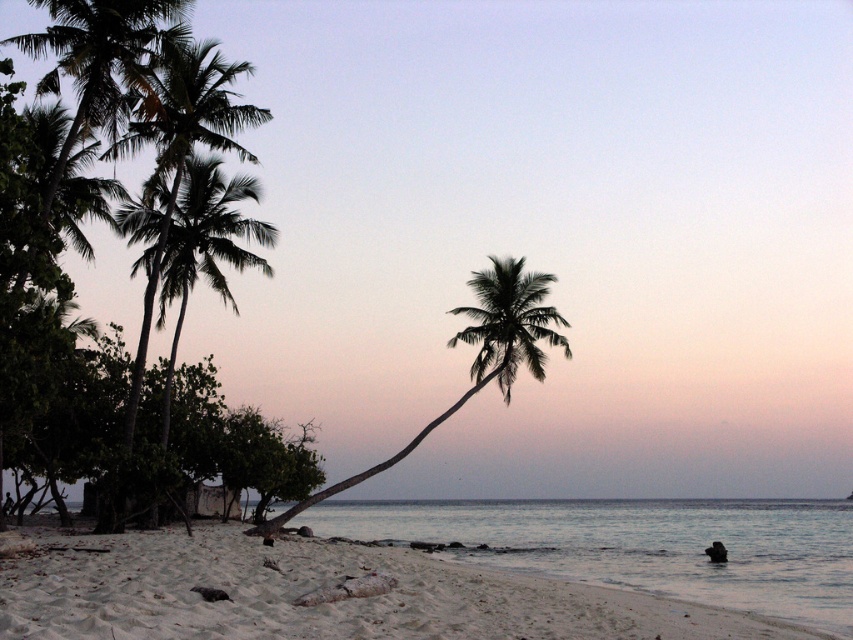
Question: Does white sandy beach at lower left come in front of green leafy palm tree at left?

Choices:
 (A) no
 (B) yes

Answer: (B)

Question: Is the position of white sandy beach at lower left more distant than that of green leafy palm tree at left?

Choices:
 (A) no
 (B) yes

Answer: (A)

Question: Is white sandy beach at lower left smaller than silhouette leafy palm at center?

Choices:
 (A) no
 (B) yes

Answer: (B)

Question: Estimate the real-world distances between objects in this image. Which object is farther from the green leafy palm tree at left?

Choices:
 (A) silhouette leafy palm at center
 (B) white sandy beach at lower left

Answer: (A)

Question: Which object is the closest to the silhouette leafy palm at center?

Choices:
 (A) green leafy palm tree at left
 (B) white sandy beach at lower left

Answer: (B)

Question: Which point is closer to the camera?

Choices:
 (A) white sandy beach at lower left
 (B) silhouette leafy palm at center

Answer: (A)